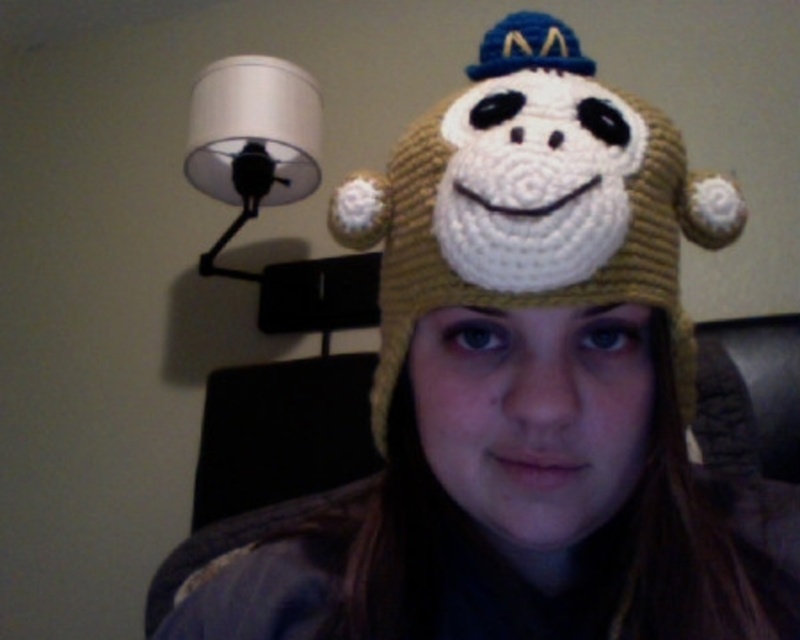
Which is above, yarn knitted hat at center or white matte lampshade at upper left?

white matte lampshade at upper left is higher up.

Is yarn knitted hat at center shorter than white matte lampshade at upper left?

Yes.

I want to click on yarn knitted hat at center, so click(533, 200).